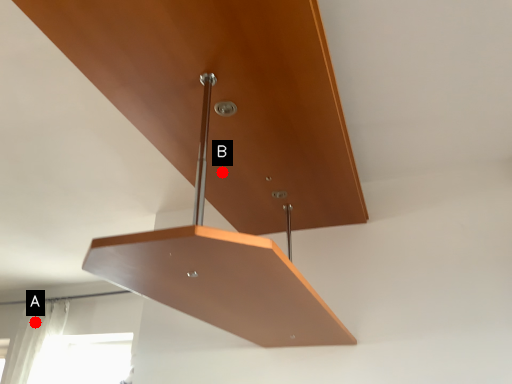
Question: Two points are circled on the image, labeled by A and B beside each circle. Which point is farther to the camera?

Choices:
 (A) A is further
 (B) B is further

Answer: (A)